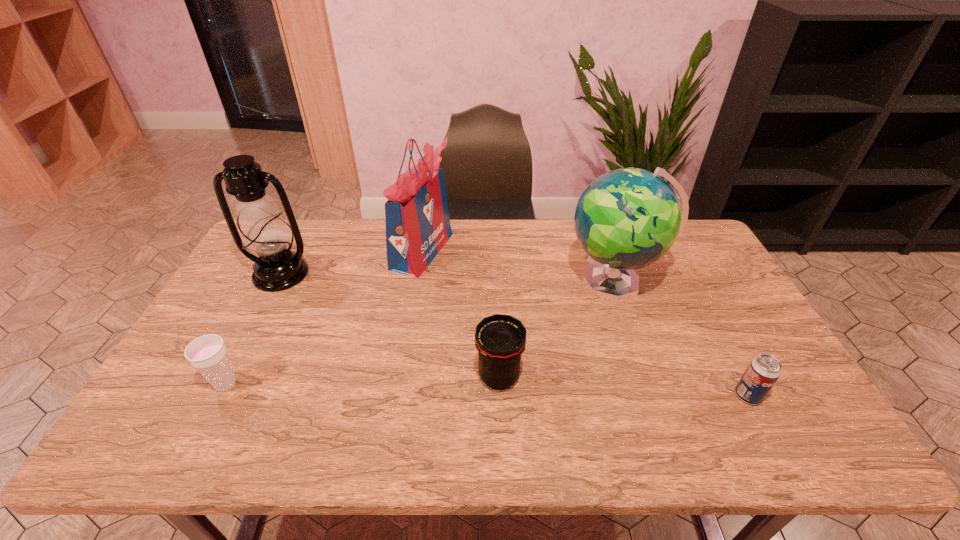
Locate an element on the screen. The image size is (960, 540). unoccupied position between the oil lamp and the fourth object from right to left is located at coordinates (351, 262).

Locate an element on the screen. free spot between the cup and the oil lamp is located at coordinates (253, 329).

This screenshot has height=540, width=960. What are the coordinates of `free space between the telephoto lens and the globe` in the screenshot? It's located at (557, 329).

Locate an element on the screen. The width and height of the screenshot is (960, 540). free space between the beer can and the third object from left to right is located at coordinates (585, 323).

I want to click on free spot between the telephoto lens and the grocery bag, so (461, 314).

At what (x,y) coordinates should I click in order to perform the action: click on blank region between the globe and the oil lamp. Please return your answer as a coordinate pair (x, y). The image size is (960, 540). Looking at the image, I should click on (447, 278).

You are a GUI agent. You are given a task and a screenshot of the screen. Output one action in this format:
    pyautogui.click(x=<x>, y=<y>)
    Task: Click on the empty space between the third object from right to left and the grocery bag
    Image resolution: width=960 pixels, height=540 pixels.
    Given the screenshot: What is the action you would take?
    [x=461, y=314]

At what (x,y) coordinates should I click in order to perform the action: click on object that can be found as the closest to the fourth object from right to left. Please return your answer as a coordinate pair (x, y). This screenshot has height=540, width=960. Looking at the image, I should click on (264, 232).

Where is `object that is the closest one to the oil lamp`? The width and height of the screenshot is (960, 540). object that is the closest one to the oil lamp is located at coordinates (417, 220).

This screenshot has width=960, height=540. What are the coordinates of `vacant space that satisfies the following two spatial constraints: 1. on the back side of the fourth object from left to right; 2. on the front-facing side of the grocery bag` in the screenshot? It's located at (494, 251).